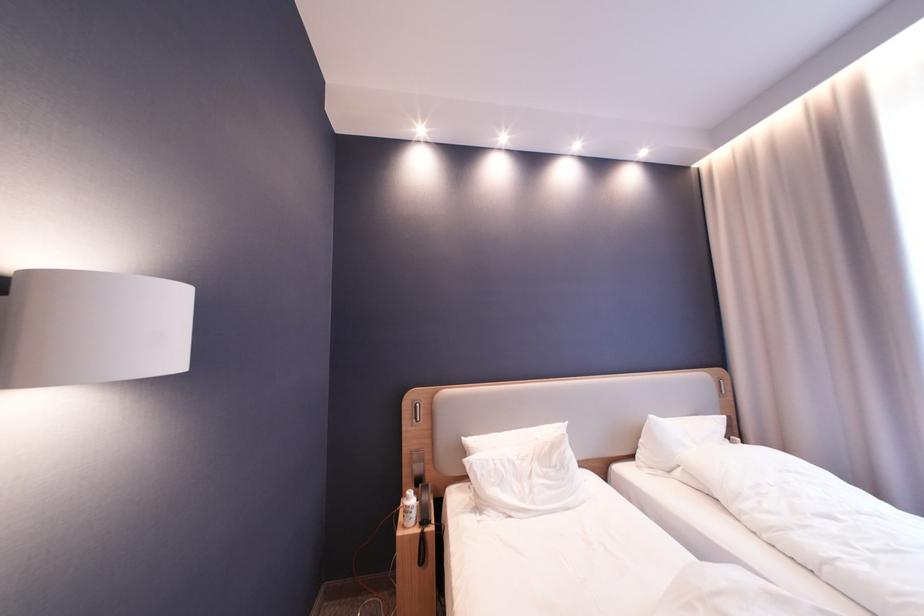
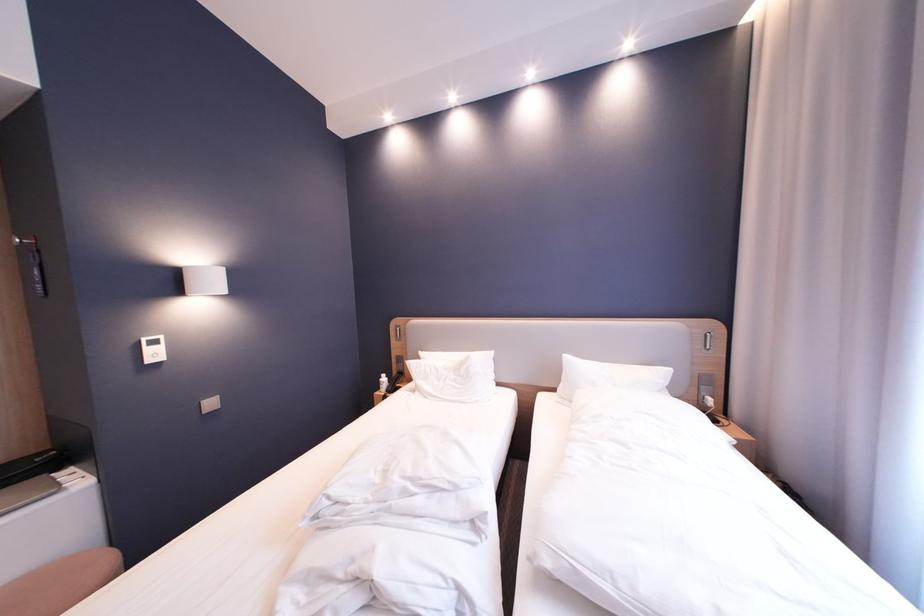
Where in the second image is the point corresponding to point (415, 423) from the first image?

(403, 339)